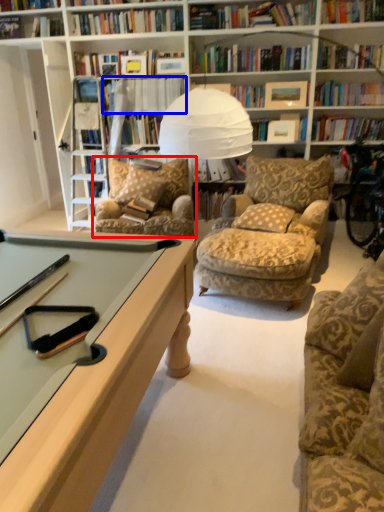
Question: Which of the following is the farthest to the observer, chair (highlighted by a red box) or book (highlighted by a blue box)?

Choices:
 (A) chair
 (B) book

Answer: (B)